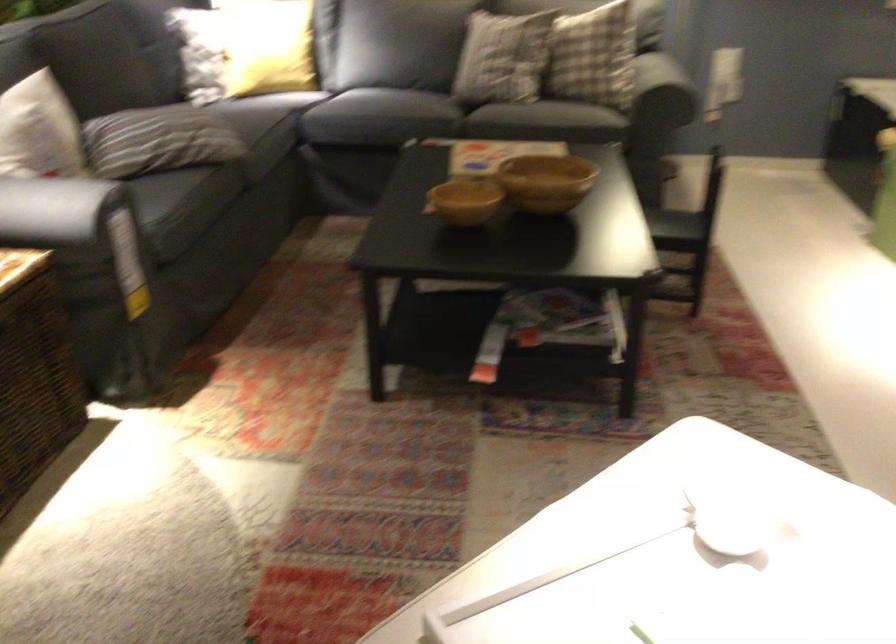
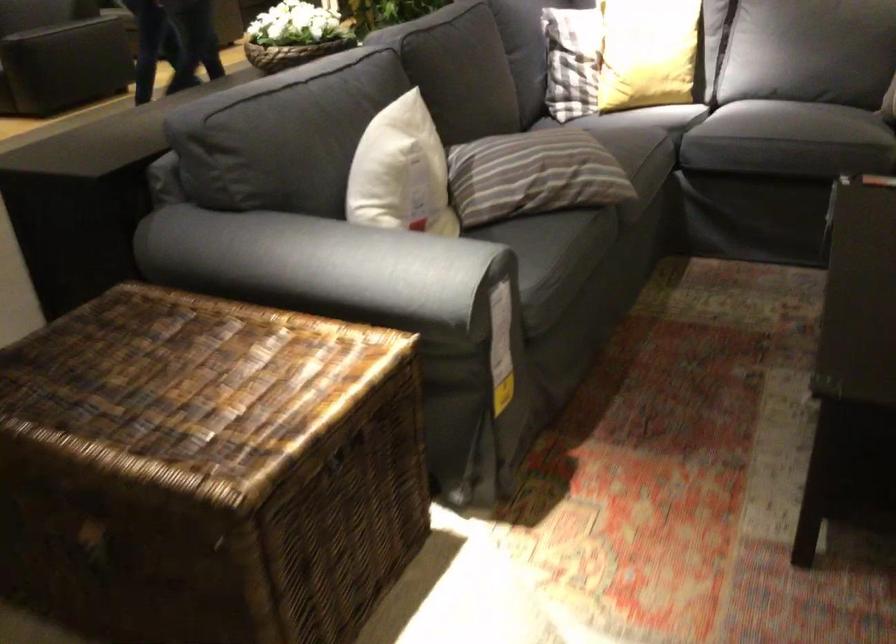
Where in the second image is the point corresponding to [162,138] from the first image?

(533, 174)